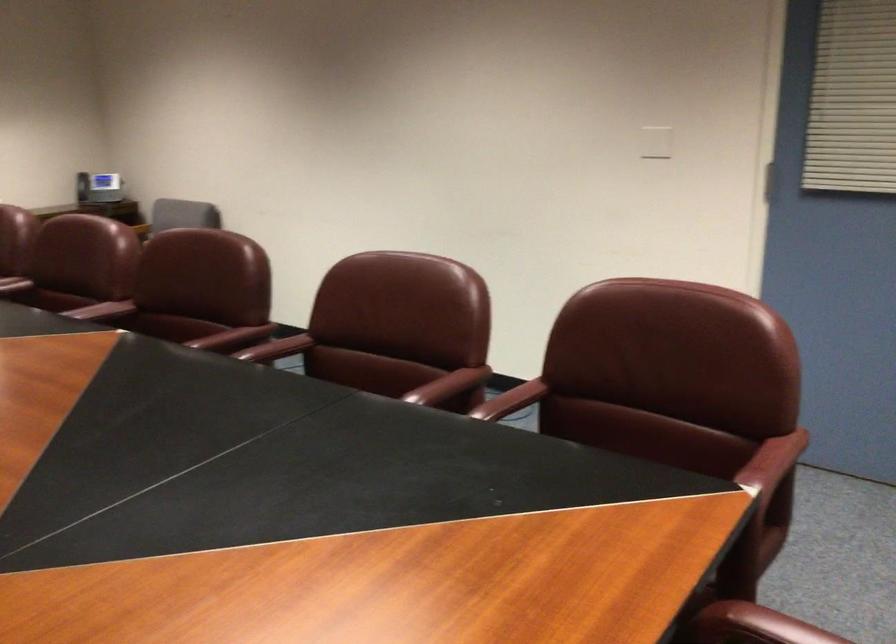
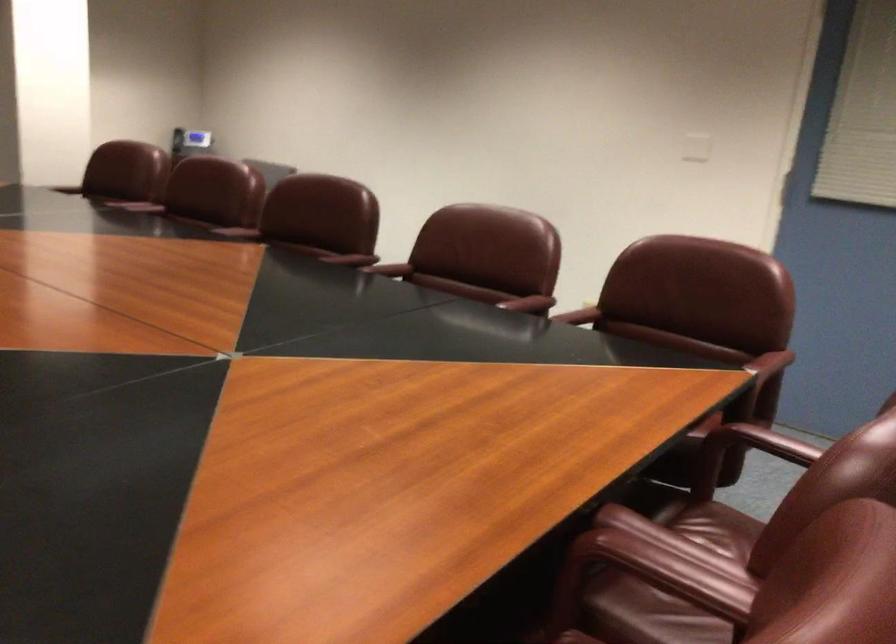
Which direction would the cameraman need to move to produce the second image?

The cameraman moved toward left, backward.